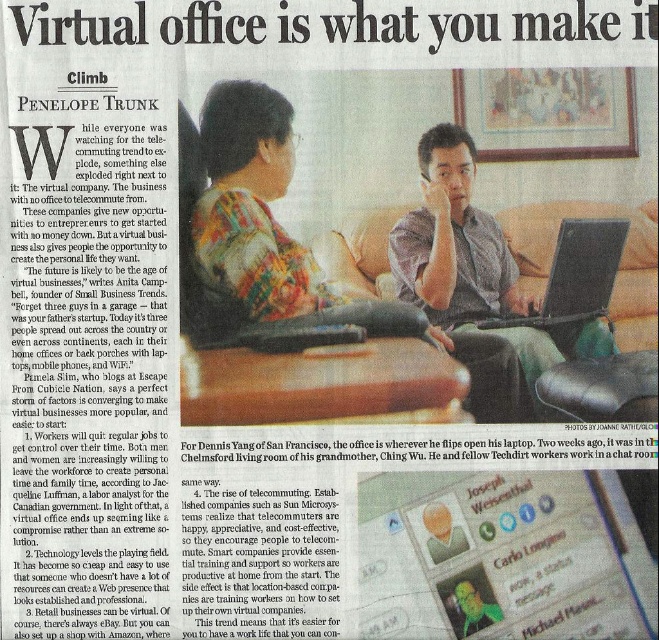
Question: Is matte gray shirt at center positioned in front of black matte laptop at center?

Choices:
 (A) yes
 (B) no

Answer: (A)

Question: Is matte gray shirt at center wider than black matte laptop at center?

Choices:
 (A) yes
 (B) no

Answer: (A)

Question: In this image, where is matte gray shirt at center located relative to black matte laptop at center?

Choices:
 (A) below
 (B) above

Answer: (A)

Question: Which point is farther to the camera?

Choices:
 (A) [627, 227]
 (B) [399, 257]

Answer: (B)